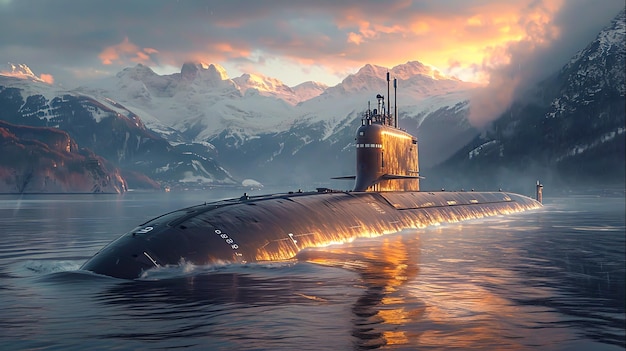
At what (x,y) coordinates should I click in order to perform the action: click on windows. Please return your answer as a coordinate pair (x, y). Looking at the image, I should click on (371, 145), (361, 134), (361, 144).